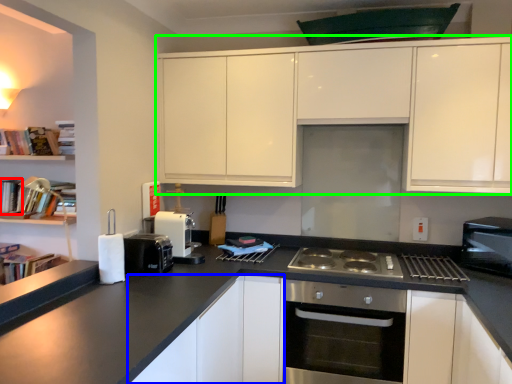
Question: Considering the real-world distances, which object is closest to book (highlighted by a red box)? cabinetry (highlighted by a blue box) or cabinetry (highlighted by a green box).

Choices:
 (A) cabinetry
 (B) cabinetry

Answer: (A)